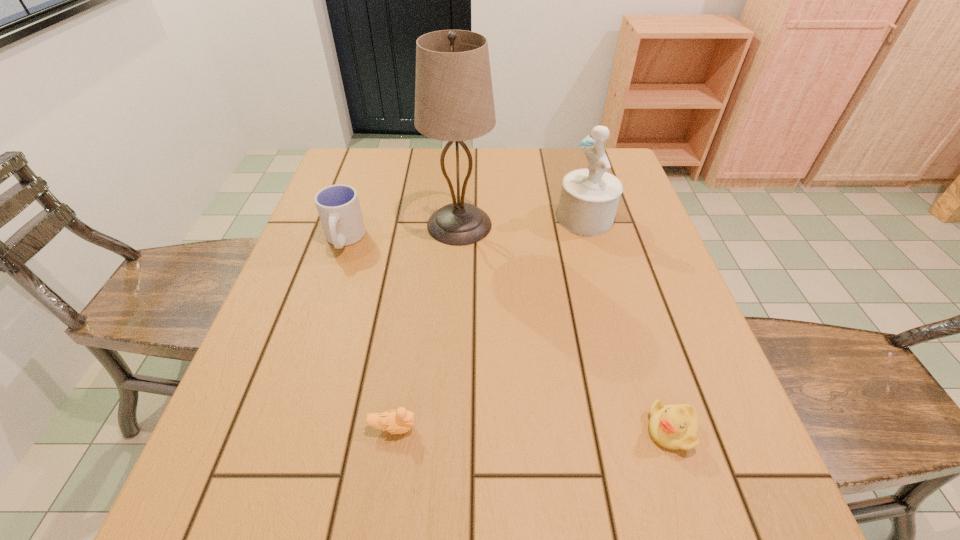
Find the location of a particular element. This screenshot has width=960, height=540. free region located 0.220m with the handle on the side of the third tallest object is located at coordinates (313, 332).

Where is `vacant space located on the beak of the right duckling`? The height and width of the screenshot is (540, 960). vacant space located on the beak of the right duckling is located at coordinates (420, 430).

Where is `vacant space located 0.370m on the beak of the right duckling`? The height and width of the screenshot is (540, 960). vacant space located 0.370m on the beak of the right duckling is located at coordinates (432, 430).

This screenshot has width=960, height=540. What are the coordinates of `vacant region located on the beak of the right duckling` in the screenshot? It's located at (514, 430).

At what (x,y) coordinates should I click in order to perform the action: click on free region located 0.190m on the face of the left duckling. Please return your answer as a coordinate pair (x, y). Looking at the image, I should click on (527, 427).

The image size is (960, 540). Identify the location of object that is at the left edge. (338, 206).

At what (x,y) coordinates should I click in order to perform the action: click on figurine positioned at the right edge. Please return your answer as a coordinate pair (x, y). This screenshot has height=540, width=960. Looking at the image, I should click on (589, 197).

This screenshot has width=960, height=540. In order to click on duckling present at the right edge in this screenshot , I will do `click(674, 427)`.

Where is `free space at the far edge of the desktop`? free space at the far edge of the desktop is located at coordinates (521, 167).

You are a GUI agent. You are given a task and a screenshot of the screen. Output one action in this format:
    pyautogui.click(x=<x>, y=<y>)
    Task: Click on the vacant space at the near edge of the desktop
    
    Given the screenshot: What is the action you would take?
    pyautogui.click(x=459, y=496)